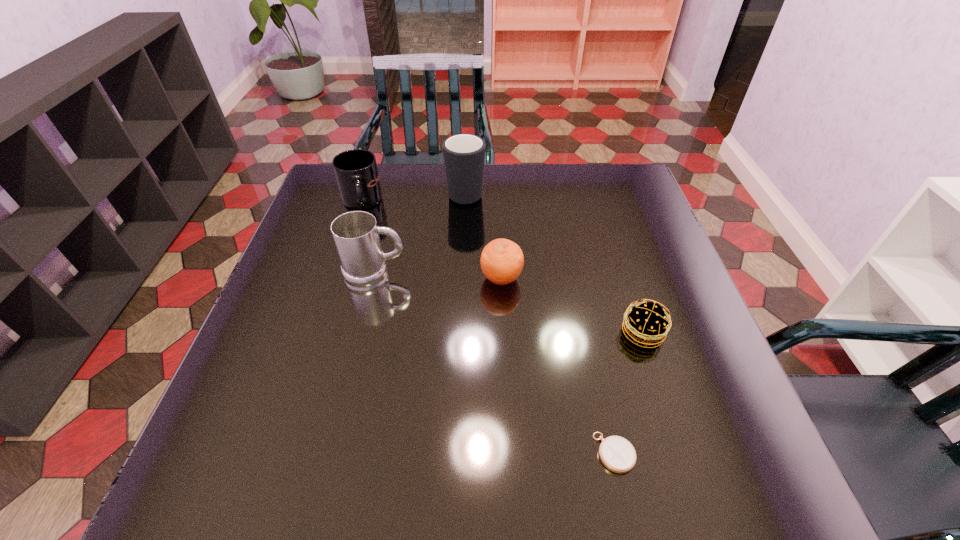
Locate an element on the screen. Image resolution: width=960 pixels, height=540 pixels. vacant space located 0.060m on the right of the nearest object is located at coordinates click(668, 453).

Where is `object that is at the near edge`? This screenshot has height=540, width=960. object that is at the near edge is located at coordinates (617, 454).

Find the location of a particular element. This screenshot has height=540, width=960. object that is at the right edge is located at coordinates (645, 324).

This screenshot has height=540, width=960. What are the coordinates of `object present at the far left corner` in the screenshot? It's located at (356, 172).

This screenshot has width=960, height=540. Identify the location of free space at the far edge. (554, 170).

The width and height of the screenshot is (960, 540). I want to click on free location at the near edge, so click(300, 485).

In the image, there is a desktop. At what (x,y) coordinates should I click in order to perform the action: click on vacant space at the left edge. Please return your answer as a coordinate pair (x, y). The height and width of the screenshot is (540, 960). Looking at the image, I should click on (311, 354).

This screenshot has height=540, width=960. Find the location of `free space at the right edge of the desktop`. free space at the right edge of the desktop is located at coordinates (653, 215).

Identify the location of vacant space at the far right corner of the desktop. (612, 178).

This screenshot has width=960, height=540. What are the coordinates of `vacant space at the near right corner of the desktop` in the screenshot? It's located at (690, 490).